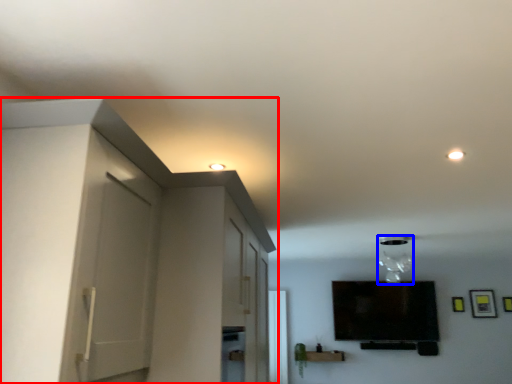
Question: Which object is closer to the camera taking this photo, dresser (highlighted by a red box) or light fixture (highlighted by a blue box)?

Choices:
 (A) dresser
 (B) light fixture

Answer: (A)